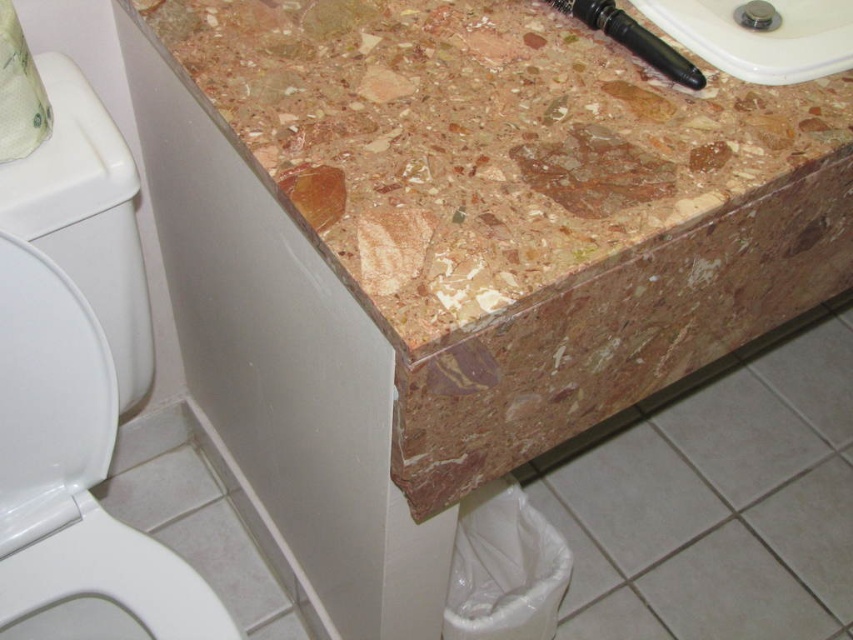
You are standing in a bathroom and see a white paper towel at upper left on the countertop. If you want to reach it without moving your feet, can you do so if your arm can extend 24 inches?

The white paper towel at upper left is 25.05 inches away from the viewer. Since your arm can only extend 24 inches, you cannot reach it without moving your feet.